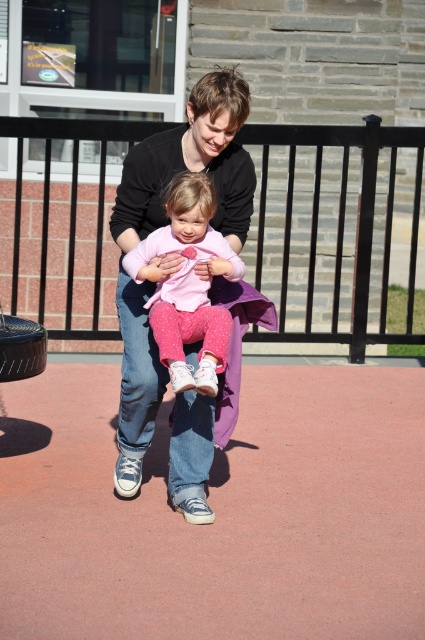
Question: Which object is positioned closest to the black metal fence at upper center?

Choices:
 (A) matte black shirt at center
 (B) pink polka dot pants at center

Answer: (A)

Question: Among these points, which one is farthest from the camera?

Choices:
 (A) (223, 193)
 (B) (329, 252)

Answer: (B)

Question: Does black metal fence at upper center have a greater width compared to pink polka dot pants at center?

Choices:
 (A) yes
 (B) no

Answer: (B)

Question: Does black metal fence at upper center lie behind matte black shirt at center?

Choices:
 (A) no
 (B) yes

Answer: (B)

Question: Is black metal fence at upper center bigger than pink polka dot pants at center?

Choices:
 (A) yes
 (B) no

Answer: (B)

Question: Which is nearer to the matte black shirt at center?

Choices:
 (A) black metal fence at upper center
 (B) pink polka dot pants at center

Answer: (B)